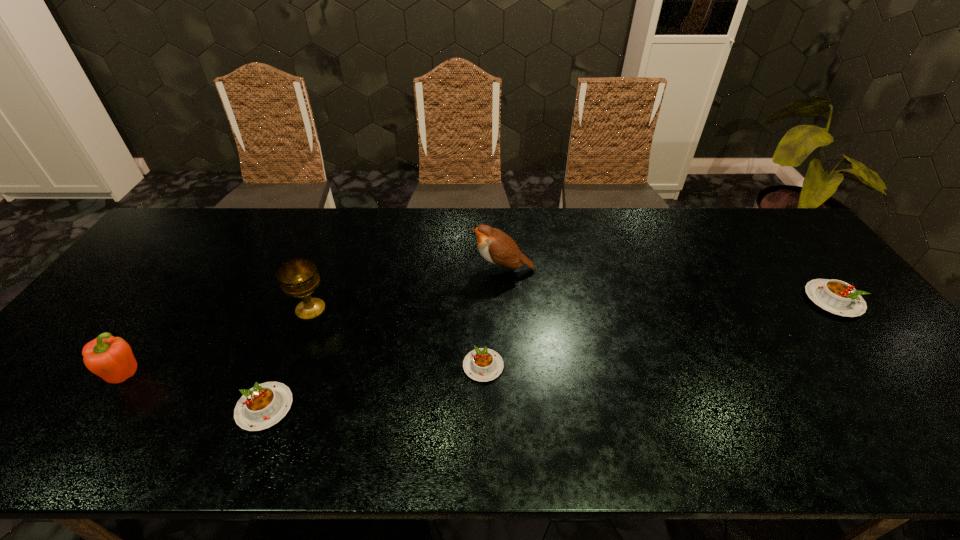
Where is `free space that satisfies the following two spatial constraints: 1. on the back side of the leftmost pudding; 2. on the left side of the shortest object`? This screenshot has width=960, height=540. free space that satisfies the following two spatial constraints: 1. on the back side of the leftmost pudding; 2. on the left side of the shortest object is located at coordinates (281, 366).

Where is `free space that satisfies the following two spatial constraints: 1. on the back side of the nearest pudding; 2. on the right side of the rightmost pudding`? This screenshot has height=540, width=960. free space that satisfies the following two spatial constraints: 1. on the back side of the nearest pudding; 2. on the right side of the rightmost pudding is located at coordinates (307, 300).

Where is `vacant space that satisfies the following two spatial constraints: 1. on the back side of the rightmost pudding; 2. at the face of the bird`? This screenshot has height=540, width=960. vacant space that satisfies the following two spatial constraints: 1. on the back side of the rightmost pudding; 2. at the face of the bird is located at coordinates pyautogui.click(x=808, y=269).